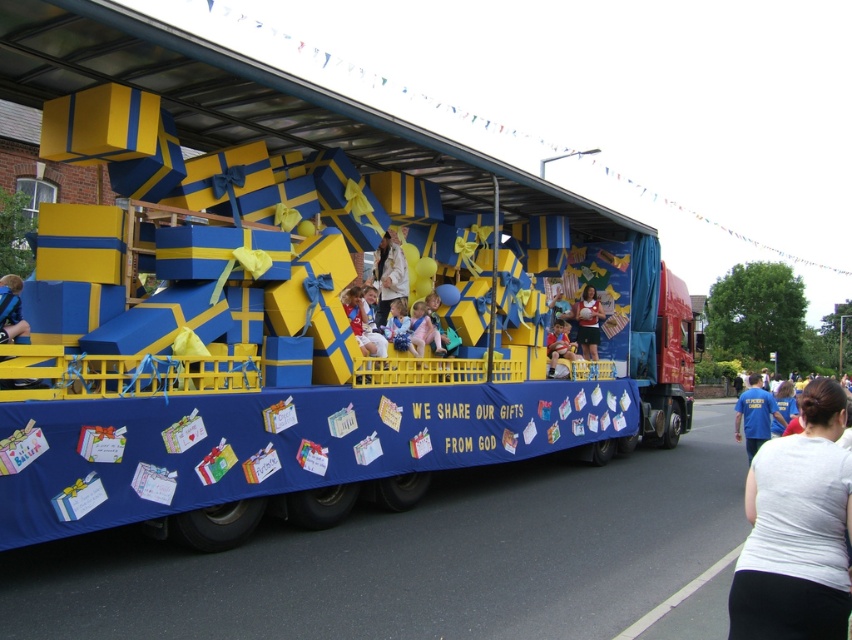
What is the color of the object located at point (389,275) on the image?

The object at point (389,275) is light beige fabric at center.

You are standing at the front of the parade float and see the point marked at coordinates (797, 531). What object is located at that point?

The point at coordinates (797, 531) marks the white cotton shirt at lower right.